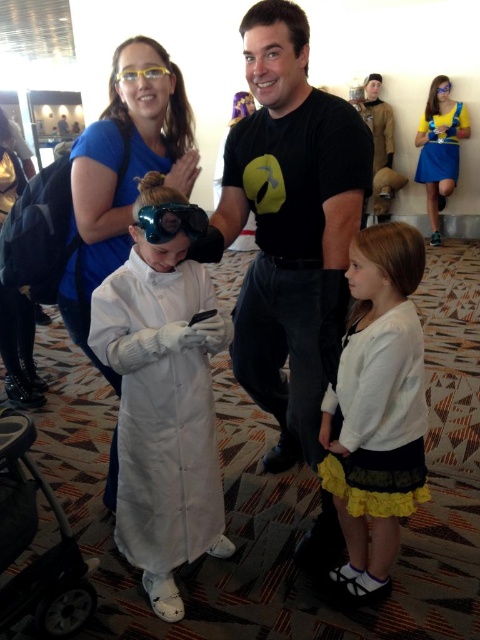
Question: In this image, where is black matte t-shirt at center located relative to blue satin dress at upper right?

Choices:
 (A) above
 (B) below

Answer: (B)

Question: Which point appears closest to the camera in this image?

Choices:
 (A) (459, 116)
 (B) (157, 243)
 (C) (99, 349)
 (D) (430, 145)

Answer: (B)

Question: Which object appears farthest from the camera in this image?

Choices:
 (A) white soft sweater at center
 (B) yellow fabric skirt at upper right
 (C) black plastic baby carriage at lower left
 (D) blue satin dress at upper right

Answer: (D)

Question: Is yellow fabric skirt at upper right positioned behind blue satin dress at upper right?

Choices:
 (A) yes
 (B) no

Answer: (B)

Question: Does white soft sweater at center appear on the left side of yellow fabric skirt at upper right?

Choices:
 (A) yes
 (B) no

Answer: (A)

Question: Which point is farther to the camera?

Choices:
 (A) 434,152
 (B) 213,340
 (C) 55,515
 (D) 422,400

Answer: (A)